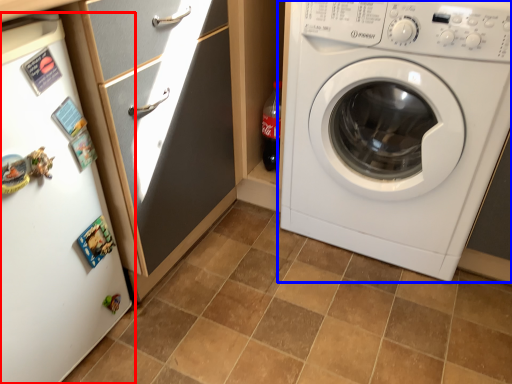
Question: Which object is further to the camera taking this photo, fridge (highlighted by a red box) or washing machine (highlighted by a blue box)?

Choices:
 (A) fridge
 (B) washing machine

Answer: (B)